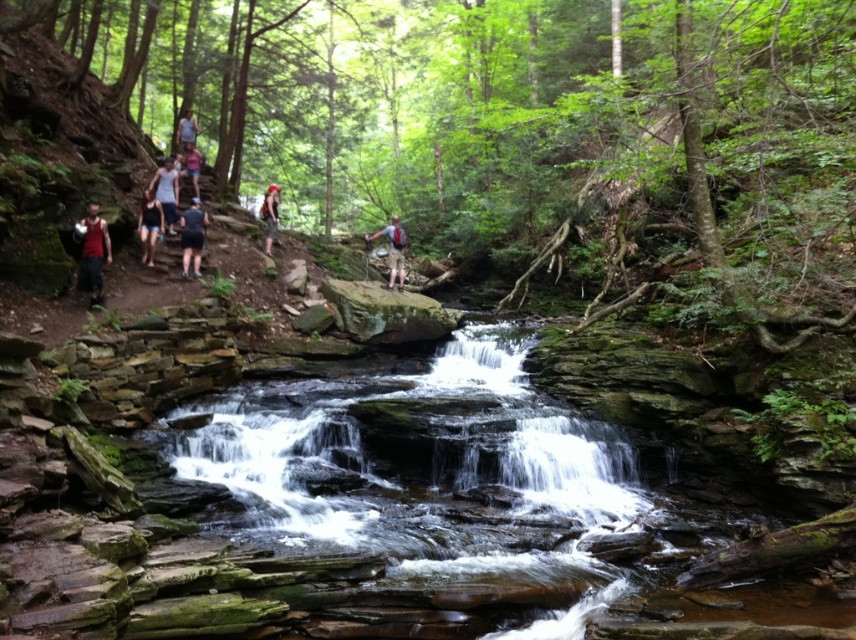
Question: Which of the following is the closest to the observer?

Choices:
 (A) matte red tank top at left
 (B) smooth rock stream at center

Answer: (B)

Question: Does smooth rock stream at center have a lesser width compared to light blue fabric shirt at upper center?

Choices:
 (A) yes
 (B) no

Answer: (B)

Question: Does smooth rock stream at center have a smaller size compared to matte black shorts at center?

Choices:
 (A) no
 (B) yes

Answer: (A)

Question: Is matte gray tank top at center to the left of light blue fabric shirt at upper center from the viewer's perspective?

Choices:
 (A) yes
 (B) no

Answer: (B)

Question: Which object is closer to the camera taking this photo?

Choices:
 (A) matte red backpack at center
 (B) light blue denim shorts at upper center
 (C) smooth rock stream at center
 (D) matte black shorts at center

Answer: (C)

Question: Which point is farther from the camera taking this photo?

Choices:
 (A) (269, 225)
 (B) (195, 196)

Answer: (A)